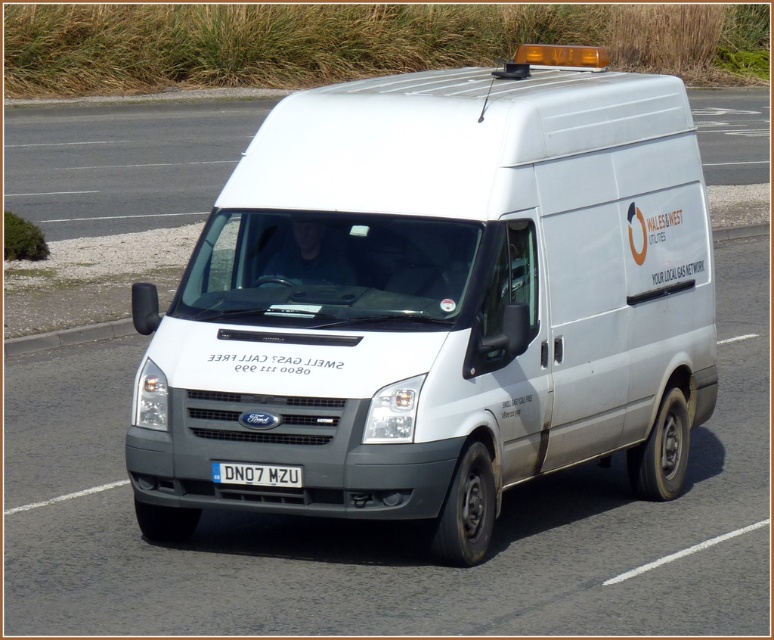
You are a traffic officer observing a road scene. You notice a white matte van at center. Based on its position, can you determine if it is positioned closer to the left or right side of the road?

The white matte van at center is located at point coordinates that are not explicitly indicating left or right dominance, so it is positioned in the center of the road.